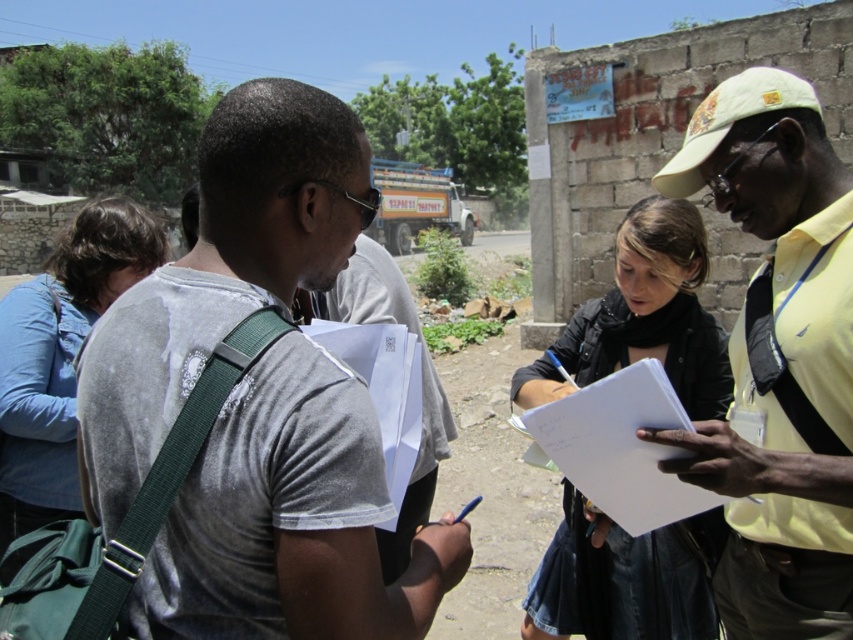
Is the position of gray cotton t-shirt at center less distant than that of blue denim jacket at left?

Yes, it is.

At what (x,y) coordinates should I click in order to perform the action: click on gray cotton t-shirt at center. Please return your answer as a coordinate pair (x, y). This screenshot has height=640, width=853. Looking at the image, I should click on (291, 520).

How far apart are yellow fabric shirt at right and black leather jacket at center?

yellow fabric shirt at right is 22.34 inches from black leather jacket at center.

Does yellow fabric shirt at right appear on the right side of black leather jacket at center?

Indeed, yellow fabric shirt at right is positioned on the right side of black leather jacket at center.

Is point (757, 272) behind point (666, 532)?

That is True.

You are a GUI agent. You are given a task and a screenshot of the screen. Output one action in this format:
    pyautogui.click(x=<x>, y=<y>)
    Task: Click on the yellow fabric shirt at right
    
    Given the screenshot: What is the action you would take?
    pyautogui.click(x=778, y=358)

Which is more to the right, black leather jacket at center or blue denim jacket at left?

black leather jacket at center is more to the right.

Which is in front, point (657, 250) or point (44, 348)?

Point (657, 250)

This screenshot has height=640, width=853. Identify the location of black leather jacket at center. (654, 310).